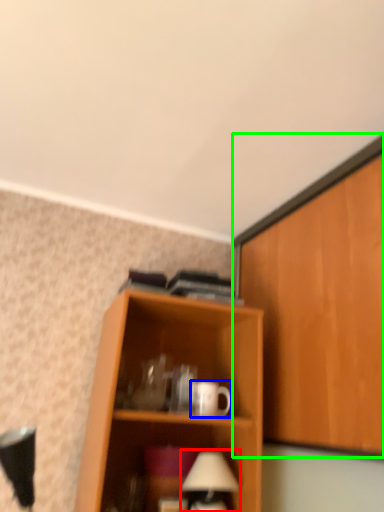
Question: Which object is positioned closest to table lamp (highlighted by a red box)? Select from mug (highlighted by a blue box) and cabinetry (highlighted by a green box).

Choices:
 (A) mug
 (B) cabinetry

Answer: (A)